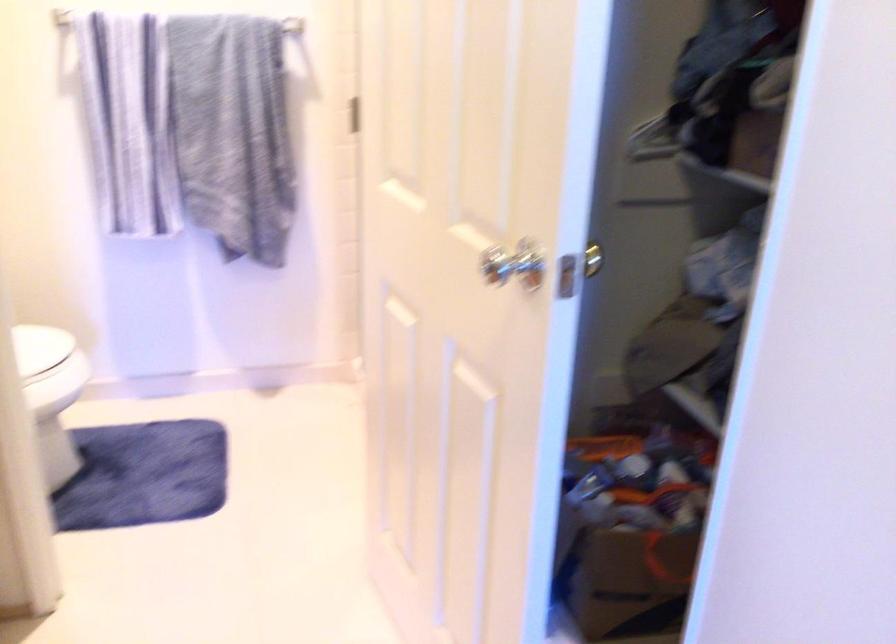
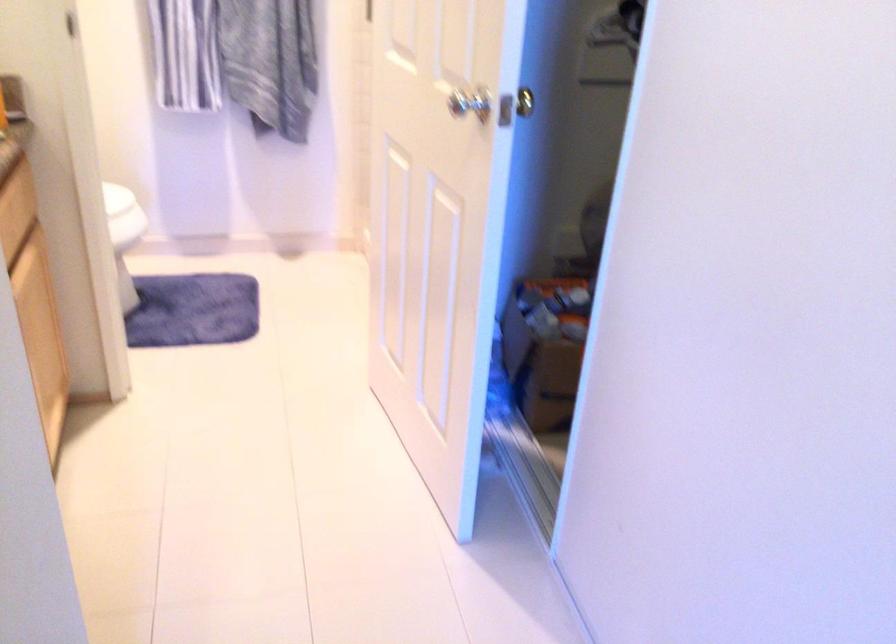
Question: In a continuous first-person perspective shot, in which direction is the camera moving?

Choices:
 (A) Left
 (B) Right
 (C) Forward
 (D) Backward

Answer: (D)